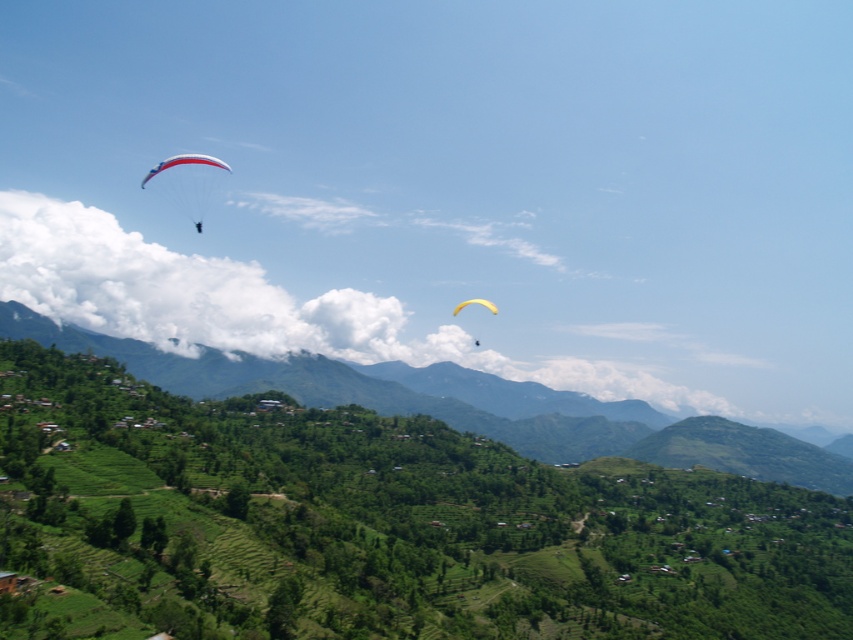
Question: Does matte red and white parachute at upper left lie behind yellow matte parachute at upper center?

Choices:
 (A) yes
 (B) no

Answer: (A)

Question: Can you confirm if matte red and white parachute at upper left is positioned below yellow matte parachute at upper center?

Choices:
 (A) yes
 (B) no

Answer: (B)

Question: Which point appears closest to the camera in this image?

Choices:
 (A) (589, 406)
 (B) (467, 300)

Answer: (A)

Question: Which point is farther to the camera?

Choices:
 (A) green terraced field at center
 (B) matte red and white parachute at upper left
 (C) yellow matte parachute at upper center

Answer: (B)

Question: Does green terraced field at center have a larger size compared to matte red and white parachute at upper left?

Choices:
 (A) no
 (B) yes

Answer: (B)

Question: Which of the following is the farthest from the observer?

Choices:
 (A) (140, 184)
 (B) (461, 304)
 (C) (117, 358)

Answer: (A)